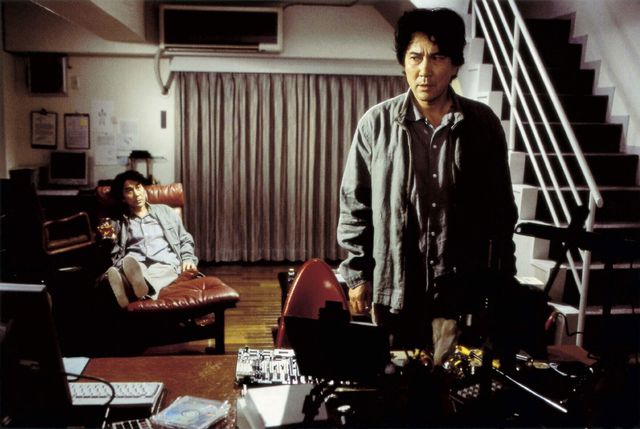
The image size is (640, 429). What are the coordinates of `keyboard` in the screenshot? It's located at (111, 400).